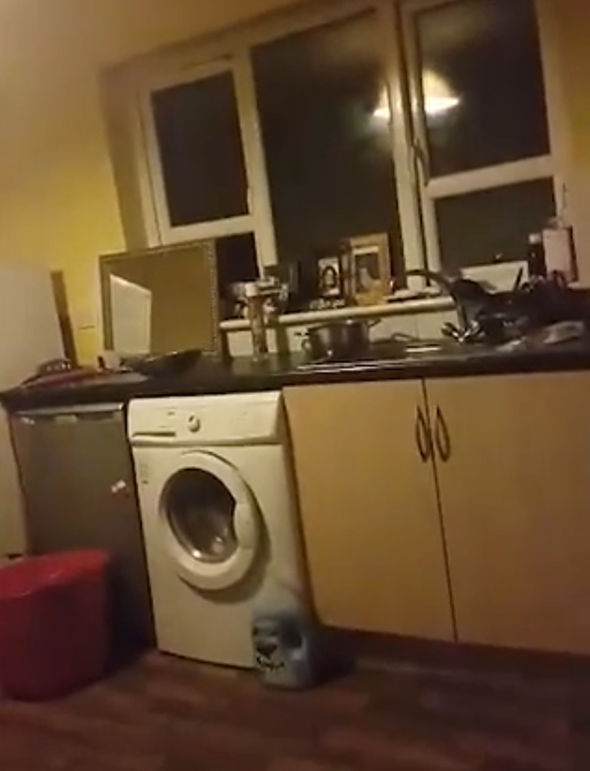
Where is `red bin`? The height and width of the screenshot is (771, 590). red bin is located at coordinates (74, 631).